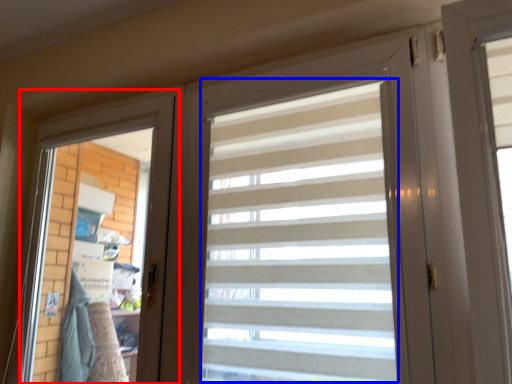
Question: Which of the following is the closest to the observer, screen door (highlighted by a red box) or curtain (highlighted by a blue box)?

Choices:
 (A) screen door
 (B) curtain

Answer: (B)